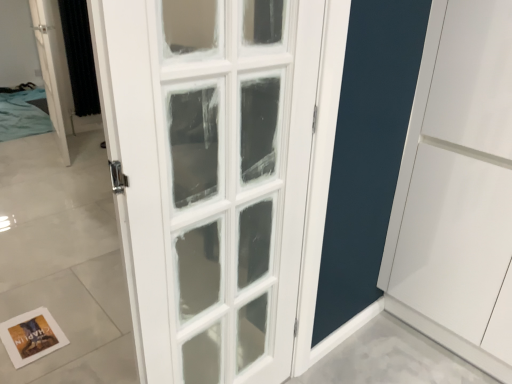
Question: Does black textured curtain at left have a lesser width compared to white glass door at upper left?

Choices:
 (A) no
 (B) yes

Answer: (B)

Question: From a real-world perspective, does black textured curtain at left sit lower than white glass door at upper left?

Choices:
 (A) no
 (B) yes

Answer: (A)

Question: Is black textured curtain at left wider than white glass door at upper left?

Choices:
 (A) no
 (B) yes

Answer: (A)

Question: Considering the relative sizes of black textured curtain at left and white glass door at upper left in the image provided, is black textured curtain at left smaller than white glass door at upper left?

Choices:
 (A) no
 (B) yes

Answer: (B)

Question: Is black textured curtain at left to the left of white glass door at upper left from the viewer's perspective?

Choices:
 (A) yes
 (B) no

Answer: (B)

Question: Is black textured curtain at left facing away from white glass door at upper left?

Choices:
 (A) no
 (B) yes

Answer: (A)

Question: Can you confirm if white glass door at upper left is positioned to the left of black textured curtain at left?

Choices:
 (A) yes
 (B) no

Answer: (A)

Question: From a real-world perspective, does white glass door at upper left sit lower than black textured curtain at left?

Choices:
 (A) yes
 (B) no

Answer: (A)

Question: Is black textured curtain at left at the back of white glass door at upper left?

Choices:
 (A) yes
 (B) no

Answer: (A)

Question: Is white glass door at upper left bigger than black textured curtain at left?

Choices:
 (A) no
 (B) yes

Answer: (B)

Question: Is black textured curtain at left completely or partially inside white glass door at upper left?

Choices:
 (A) no
 (B) yes

Answer: (A)

Question: Could you tell me if white glass door at upper left is turned towards black textured curtain at left?

Choices:
 (A) no
 (B) yes

Answer: (A)

Question: Can you confirm if black textured curtain at left is positioned to the left of white paper postcard at lower left?

Choices:
 (A) yes
 (B) no

Answer: (A)